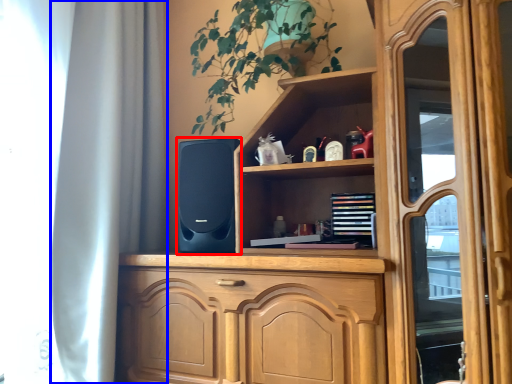
Question: Which object appears closest to the camera in this image, speaker (highlighted by a red box) or curtain (highlighted by a blue box)?

Choices:
 (A) speaker
 (B) curtain

Answer: (B)